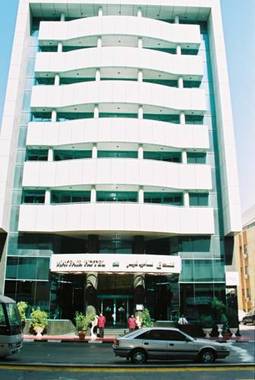
Where is `planter`? The height and width of the screenshot is (380, 255). planter is located at coordinates (235, 331).